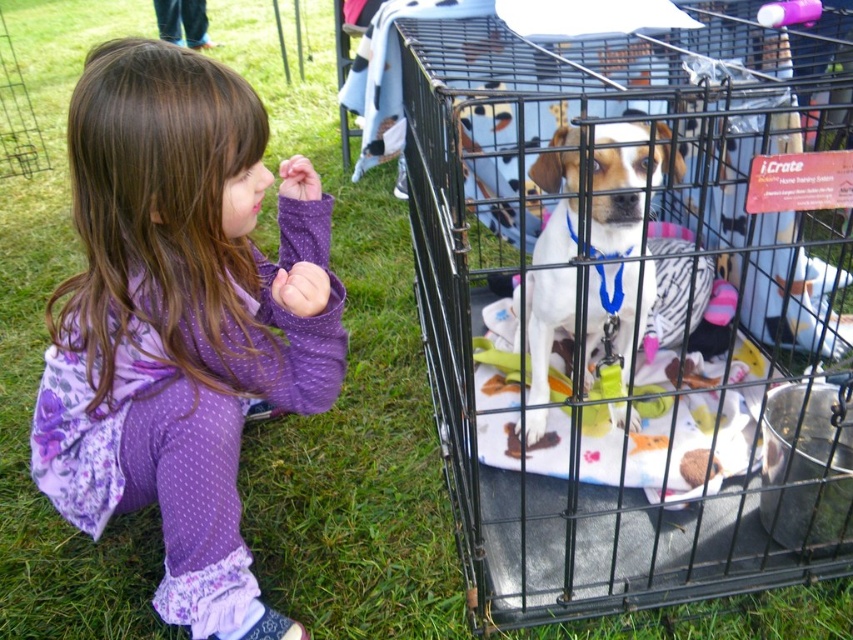
You are a delivery person who needs to place a large package in this area. The package is the same size as the purple polka dot dress at lower left. Is there enough space inside the black wire cage at center to fit the package?

The black wire cage at center has a larger size compared to purple polka dot dress at lower left, so the package should fit inside the black wire cage at center since it is bigger than the dress.

What are the coordinates of the black wire cage at center?

The black wire cage at center is located at point [640,353].